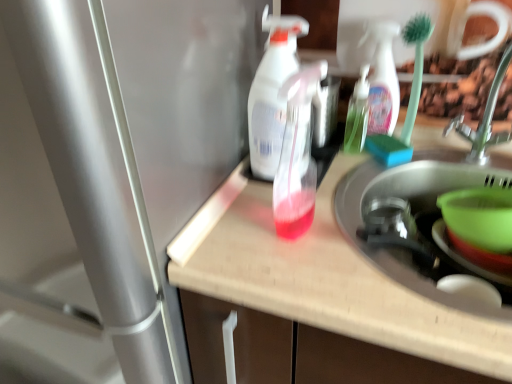
What are the coordinates of `free space between translucent plastic spray bottle at center, marked as the 1th bottle in a front-to-back arrangement, and translucent plastic bottle at center, which is the 1th bottle from back to front` in the screenshot? It's located at click(x=333, y=180).